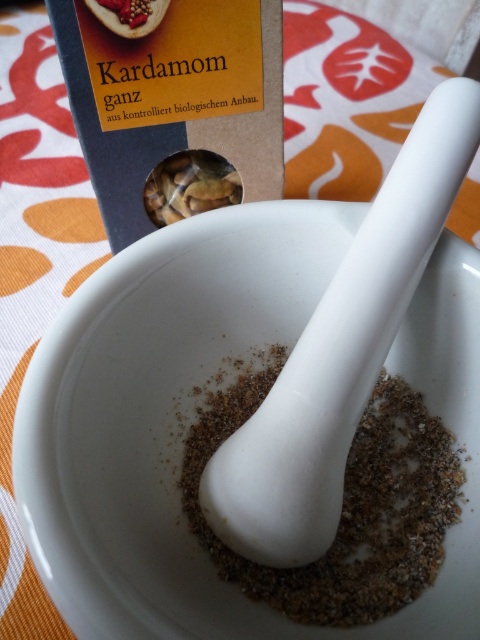
You are a chef preparing a spice blend and need to identify the taller ingredient between the brown matte almonds at center and the brown matte cardamom at upper left. Which one should you choose?

The brown matte almonds at center is much taller than the brown matte cardamom at upper left, so you should choose the brown matte almonds at center as the taller ingredient.

You are a chef preparing a spice blend and need to grind the brown matte cardamom at upper left using the white matte mortar and pestle at center. Can you reach the cardamom without moving the mortar and pestle?

The white matte mortar and pestle at center is 30.42 inches away from the brown matte cardamom at upper left. Since the mortar and pestle are stationary, you can reach the cardamom by extending your hand the required distance, so yes, you can reach it without moving the mortar and pestle.